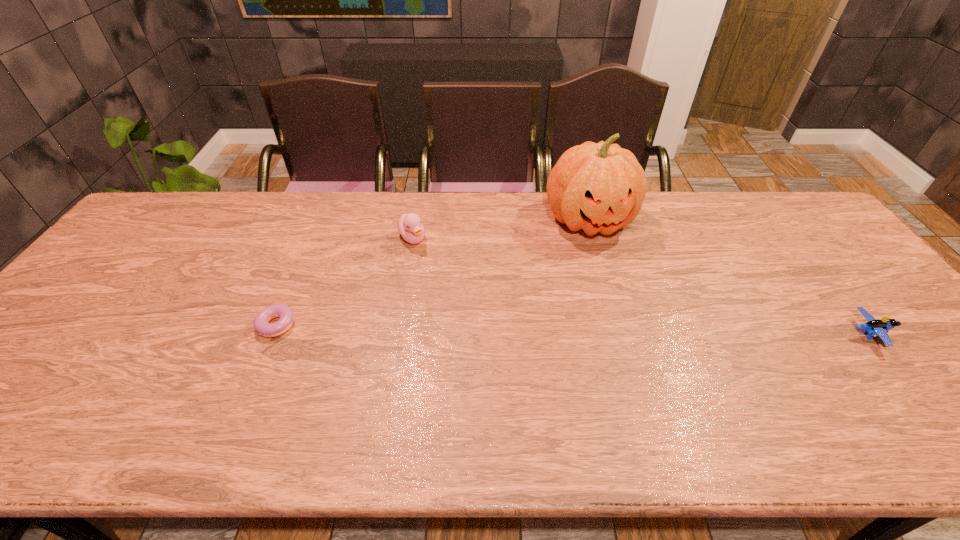
Find the location of a particular element. The width and height of the screenshot is (960, 540). the shortest object is located at coordinates (261, 323).

Find the location of a particular element. Image resolution: width=960 pixels, height=540 pixels. doughnut is located at coordinates point(261,323).

You are a GUI agent. You are given a task and a screenshot of the screen. Output one action in this format:
    pyautogui.click(x=<x>, y=<y>)
    Task: Click on the Lego
    This screenshot has height=540, width=960.
    Given the screenshot: What is the action you would take?
    pyautogui.click(x=874, y=327)

Find the location of a particular element. Image resolution: width=960 pixels, height=540 pixels. the second shortest object is located at coordinates (874, 327).

In order to click on the third object from left to right in this screenshot , I will do `click(600, 187)`.

Find the location of a particular element. The height and width of the screenshot is (540, 960). pumpkin is located at coordinates (600, 187).

In order to click on duckling in this screenshot , I will do `click(410, 226)`.

Where is `the third object from right to left`? Image resolution: width=960 pixels, height=540 pixels. the third object from right to left is located at coordinates (410, 226).

What are the coordinates of `free space located 0.400m on the back of the leftmost object` in the screenshot? It's located at (324, 217).

Where is `vacant space located on the front-facing side of the second shortest object`? The width and height of the screenshot is (960, 540). vacant space located on the front-facing side of the second shortest object is located at coordinates (915, 334).